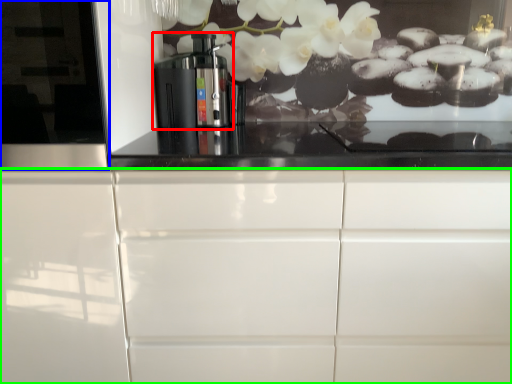
Question: Which is nearer to the home appliance (highlighted by a red box)? glass door (highlighted by a blue box) or cabinetry (highlighted by a green box).

Choices:
 (A) glass door
 (B) cabinetry

Answer: (A)